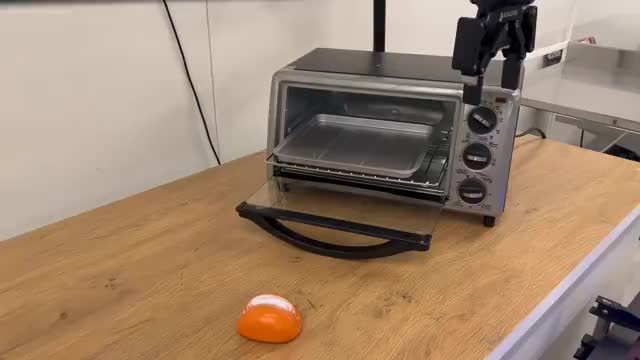
The image size is (640, 360). Identify the location of handles. (358, 252).